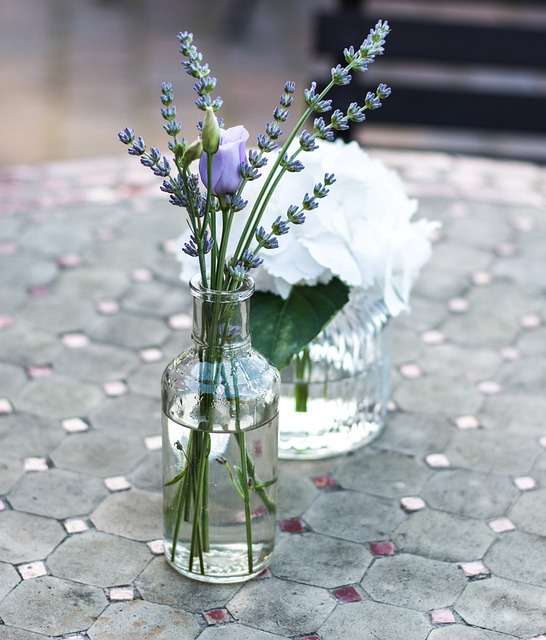
Image resolution: width=546 pixels, height=640 pixels. In order to click on stairs in this screenshot , I will do `click(448, 64)`.